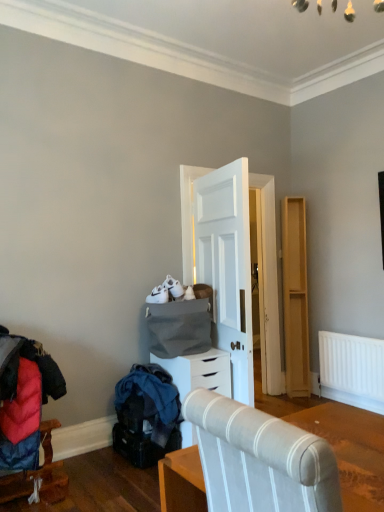
Question: Based on their sizes in the image, would you say light wood dresser at right is bigger or smaller than white matte chest of drawers at center?

Choices:
 (A) big
 (B) small

Answer: (B)

Question: Is light wood dresser at right spatially inside white matte chest of drawers at center, or outside of it?

Choices:
 (A) outside
 (B) inside

Answer: (A)

Question: Considering the real-world distances, which object is farthest from the textured fabric chair at center, positioned as the first furniture in front-to-back order?

Choices:
 (A) white matte chest of drawers at center
 (B) light wood dresser at right
 (C) velvet red coat at lower left, the 2th furniture when ordered from right to left

Answer: (B)

Question: Which of these objects is positioned farthest from the velvet red coat at lower left, which is counted as the second furniture, starting from the top?

Choices:
 (A) light wood dresser at right
 (B) white matte chest of drawers at center
 (C) textured fabric chair at center, placed as the 1th furniture when sorted from top to bottom

Answer: (A)